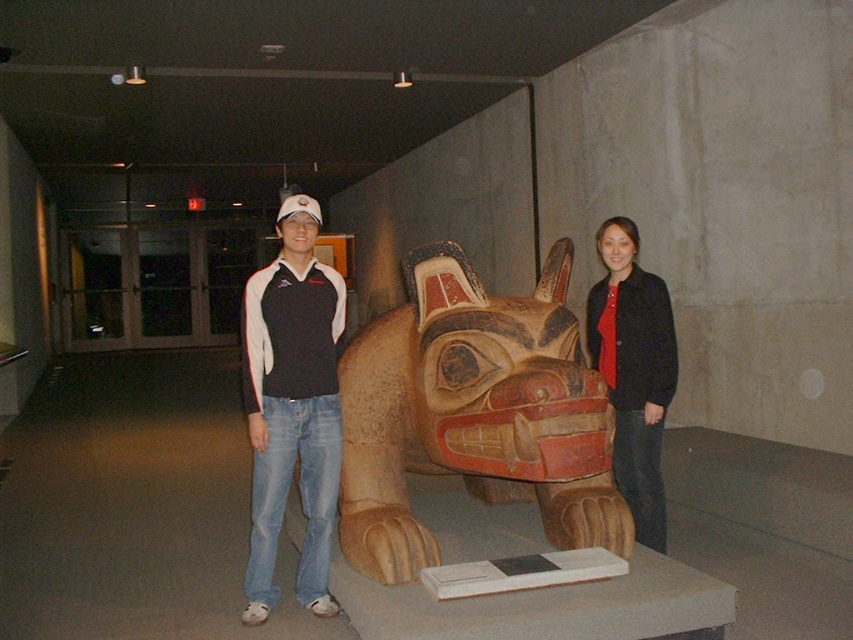
Question: Where is wooden totem pole at center located in relation to matte black shirt at center in the image?

Choices:
 (A) below
 (B) above

Answer: (B)

Question: Considering the relative positions of wooden totem pole at center and matte black jacket at center in the image provided, where is wooden totem pole at center located with respect to matte black jacket at center?

Choices:
 (A) below
 (B) above

Answer: (A)

Question: Which of these objects is positioned closest to the matte black jacket at center?

Choices:
 (A) matte black shirt at center
 (B) wooden totem pole at center

Answer: (B)

Question: Is wooden totem pole at center smaller than matte black shirt at center?

Choices:
 (A) yes
 (B) no

Answer: (B)

Question: Estimate the real-world distances between objects in this image. Which object is farther from the matte black jacket at center?

Choices:
 (A) wooden totem pole at center
 (B) matte black shirt at center

Answer: (B)

Question: Among these objects, which one is nearest to the camera?

Choices:
 (A) matte black jacket at center
 (B) wooden totem pole at center
 (C) matte black shirt at center

Answer: (B)